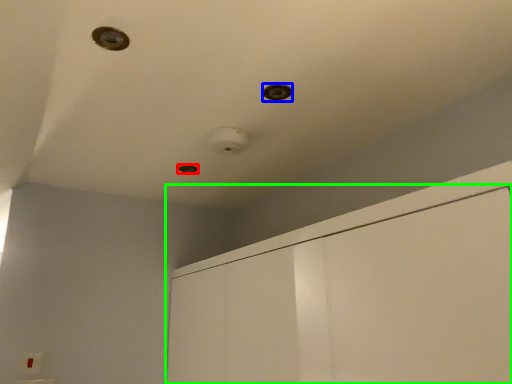
Question: Considering the real-world distances, which object is closest to hole (highlighted by a red box)? hole (highlighted by a blue box) or dresser (highlighted by a green box).

Choices:
 (A) hole
 (B) dresser

Answer: (A)